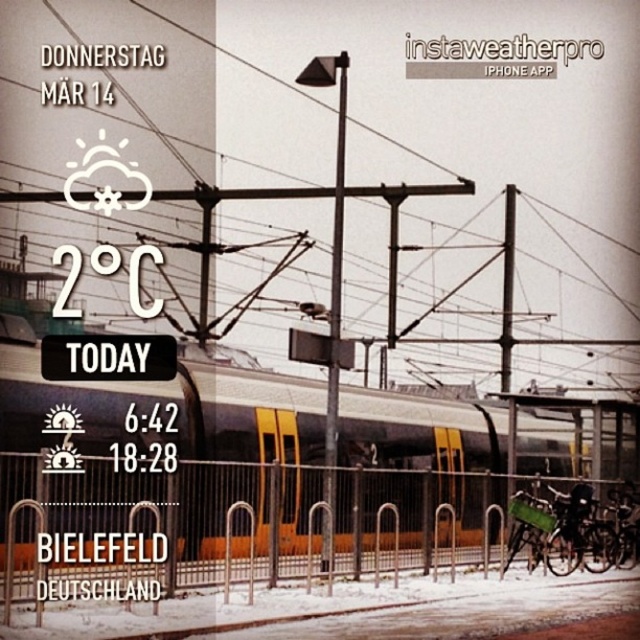
You are standing at the train station in Bielefeld, Germany, looking at the snowy platform. You see a metallic silver fence at lower center and a metallic pole at center. Which object is closer to you?

The metallic silver fence at lower center is closer to you because it is in front of the metallic pole at center.

You are standing at the train station in Bielefeld, Germany, and you see the metallic silver train at center. If you want to take a photo of it from where you are standing, will you need to use a zoom lens to capture the entire train in the frame?

The metallic silver train at center is 13.02 meters away from the camera. Depending on the focal length of your lens, you may need a zoom lens to capture the entire train in the frame from that distance. A standard lens might require stepping back, but since you can only stand where you are, a zoom lens would help include the whole train.

You are a photographer standing at the train station in Bielefeld, Germany, and you want to capture a photo of the metallic silver fence at lower center and the metallic pole at center. Based on their heights, which object will appear shorter in your photo?

Result: The metallic silver fence at lower center appears shorter in the photo because it has a lesser height compared to the metallic pole at center.